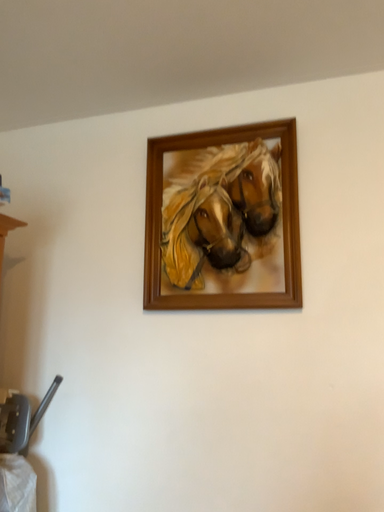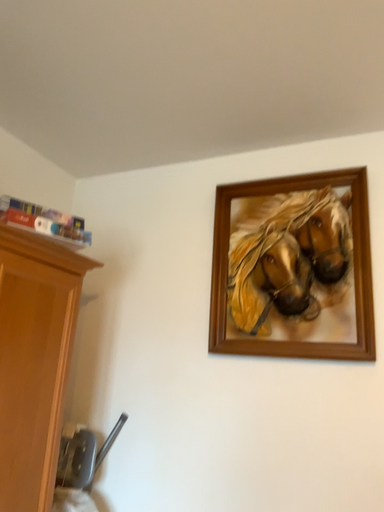
Question: Which way did the camera rotate in the video?

Choices:
 (A) rotated right
 (B) rotated left

Answer: (B)